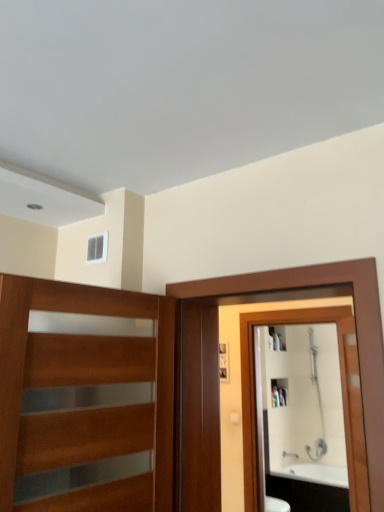
Question: From the image's perspective, relative to white glossy cabinet at upper center, is white plastic vent at upper center above or below?

Choices:
 (A) below
 (B) above

Answer: (B)

Question: Considering their positions, is white plastic vent at upper center located in front of or behind white glossy cabinet at upper center?

Choices:
 (A) behind
 (B) front

Answer: (B)

Question: Which object is the closest to the brown wooden screen door at right?

Choices:
 (A) silver metallic faucet at lower right
 (B) white glossy cabinet at upper center
 (C) white plastic vent at upper center
 (D) white glossy mirror at right
 (E) wooden with glass panels at left

Answer: (E)

Question: Which of these objects is positioned farthest from the white glossy mirror at right?

Choices:
 (A) white plastic vent at upper center
 (B) silver metallic faucet at lower right
 (C) white glossy cabinet at upper center
 (D) brown wooden screen door at right
 (E) wooden with glass panels at left

Answer: (E)